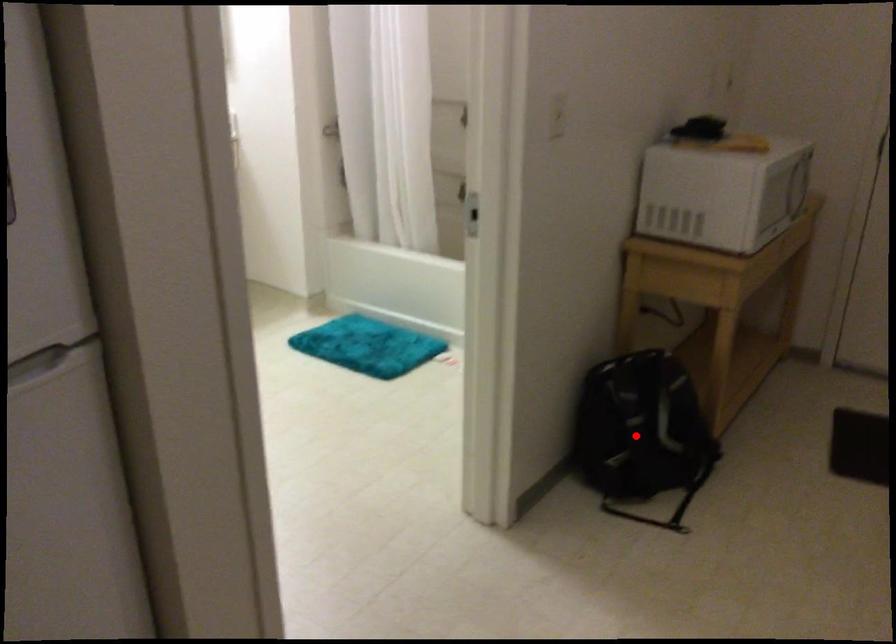
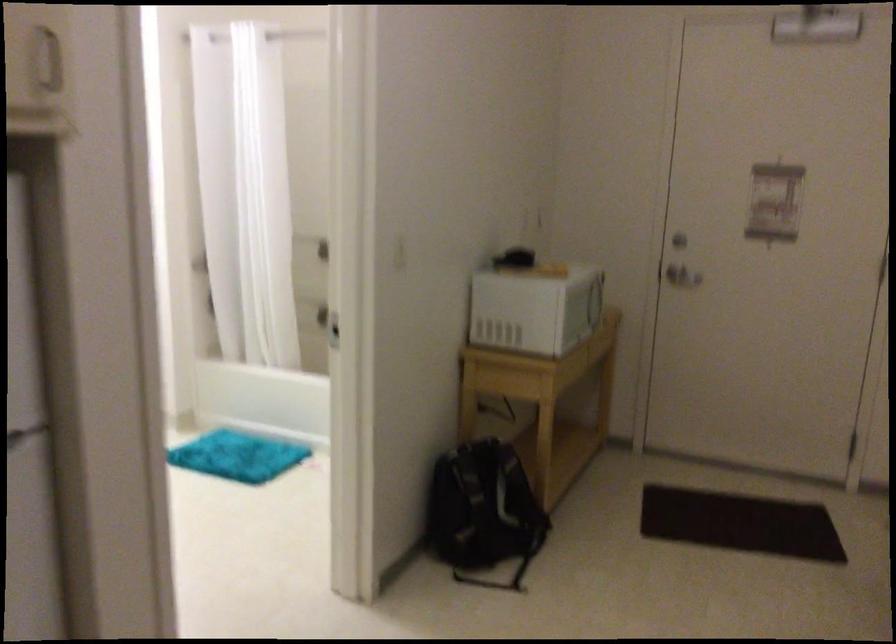
Question: I am providing you with two images of the same scene from different viewpoints. Image1 has a red point marked. In image2, the corresponding 3D location appears at what relative position? Reply with the corresponding letter.

Choices:
 (A) Closer
 (B) Farther

Answer: (B)